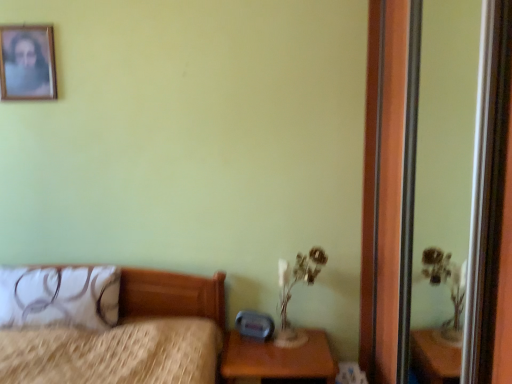
Question: From the image's perspective, is transparent glass screen door at right above or below white fabric pillow at left?

Choices:
 (A) above
 (B) below

Answer: (A)

Question: From a real-world perspective, is transparent glass screen door at right above or below white fabric pillow at left?

Choices:
 (A) above
 (B) below

Answer: (A)

Question: Based on their relative distances, which object is nearer to the translucent glass table lamp at lower right?

Choices:
 (A) wooden picture frame at upper left
 (B) brown wooden nightstand at lower right
 (C) wooden bed at left
 (D) transparent glass screen door at right
 (E) white fabric pillow at left

Answer: (B)

Question: Based on their relative distances, which object is farther from the brown wooden nightstand at lower right?

Choices:
 (A) translucent glass table lamp at lower right
 (B) white fabric pillow at left
 (C) transparent glass screen door at right
 (D) wooden bed at left
 (E) wooden picture frame at upper left

Answer: (E)